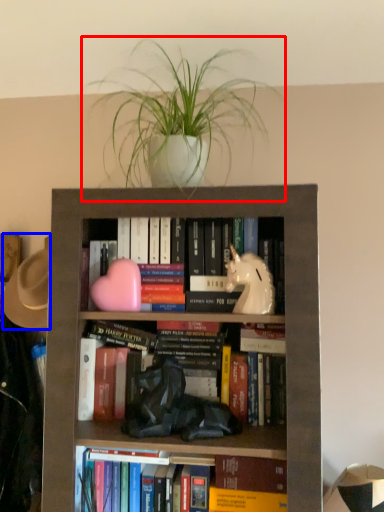
Question: Which object is further to the camera taking this photo, houseplant (highlighted by a red box) or hat (highlighted by a blue box)?

Choices:
 (A) houseplant
 (B) hat

Answer: (B)